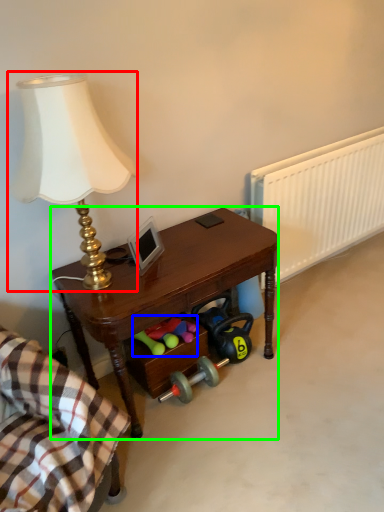
Question: Which object is the closest to the lamp (highlighted by a red box)? Choose among these: stuff (highlighted by a blue box) or desk (highlighted by a green box).

Choices:
 (A) stuff
 (B) desk

Answer: (B)